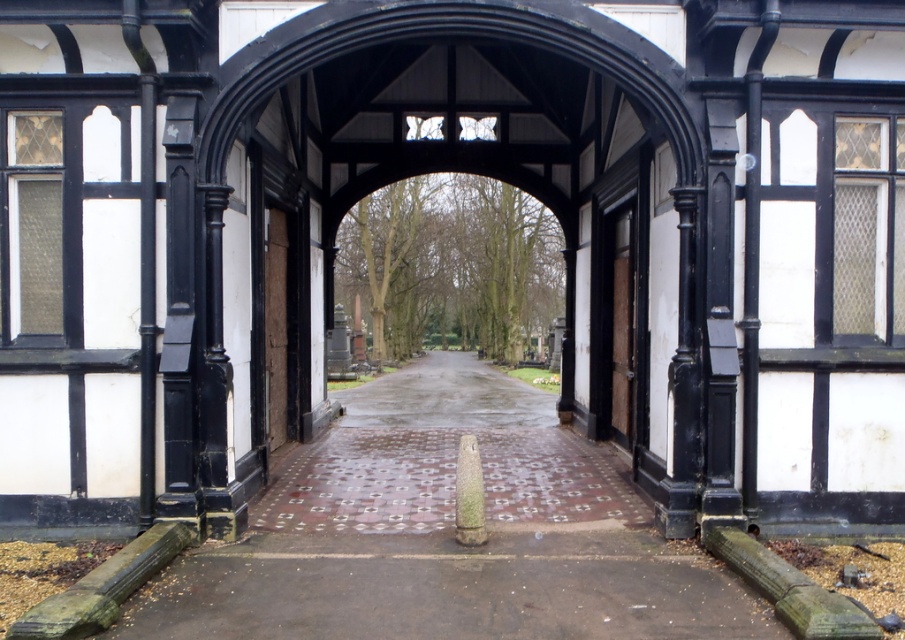
You are standing at the entrance of the Gothic archway and want to place a decorative stone marker exactly 100 feet away from where you are standing. Given the existing point at coordinates point [482,388], which is 70.33 feet from you, is this point suitable for placing the marker?

The existing point at coordinates point [482,388] is 70.33 feet from the viewer, which is closer than the desired 100 feet. Therefore, this point is not suitable for placing the marker as it does not meet the required distance.

You are standing in front of the Gothic archway and need to pass through the wooden door at center. Which direction should you move relative to the black timber archway at center to reach the door?

The wooden door at center is to the right of the black timber archway at center, so you should move to the right side of the black timber archway at center to reach the door.

Based on the photo, you are a delivery person trying to drive a small van through the black timber archway at center. The van is 2.5 meters tall. Can you safely pass under the archway without hitting the brick paved path at center?

The black timber archway at center is much taller than the brick paved path at center, so the van can safely pass under the archway as long as it stays on the brick paved path at center and does not exceed the height limit.